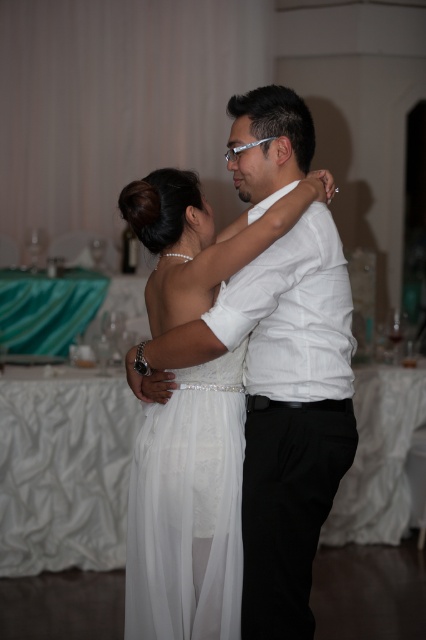
Is white satin dress at center positioned before white sheer dress at center?

Yes, white satin dress at center is in front of white sheer dress at center.

Who is more distant from viewer, (166, 326) or (241, 390)?

The point (166, 326) is more distant.

At what (x,y) coordinates should I click in order to perform the action: click on white satin dress at center. Please return your answer as a coordinate pair (x, y). The image size is (426, 640). Looking at the image, I should click on (187, 512).

The height and width of the screenshot is (640, 426). Identify the location of white satin dress at center. (187, 512).